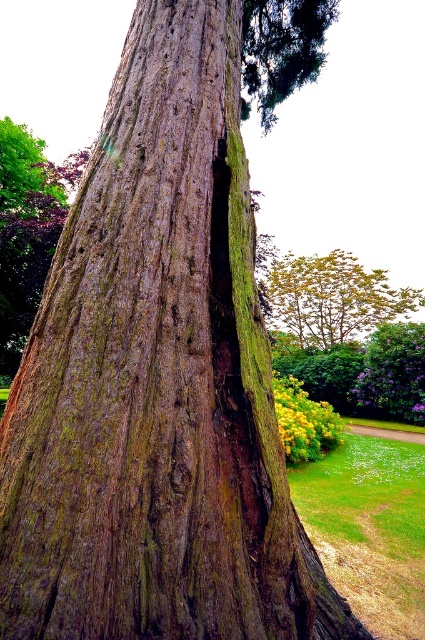
Question: Is the position of green mossy bark at upper center more distant than that of green mossy tree trunk at center?

Choices:
 (A) no
 (B) yes

Answer: (A)

Question: Is yellow-green textured tree trunk at upper right to the right of green mossy tree trunk at center from the viewer's perspective?

Choices:
 (A) no
 (B) yes

Answer: (A)

Question: Which object is closer to the camera taking this photo?

Choices:
 (A) yellow-green textured tree trunk at upper right
 (B) green mossy tree trunk at center
 (C) green mossy bark at upper center

Answer: (C)

Question: Which of the following is the farthest from the observer?

Choices:
 (A) green mossy tree trunk at center
 (B) yellow-green textured tree trunk at upper right
 (C) green mossy bark at upper center

Answer: (B)

Question: From the image, what is the correct spatial relationship of yellow-green textured tree trunk at upper right in relation to green mossy tree trunk at center?

Choices:
 (A) below
 (B) above

Answer: (B)

Question: Which is nearer to the green mossy tree trunk at center?

Choices:
 (A) green mossy bark at upper center
 (B) yellow-green textured tree trunk at upper right

Answer: (B)